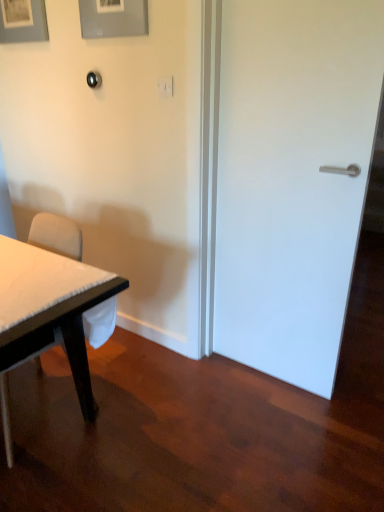
Where is `vacant space underneath white fabric chair at left (from a real-world perspective)`? The height and width of the screenshot is (512, 384). vacant space underneath white fabric chair at left (from a real-world perspective) is located at coordinates (38, 409).